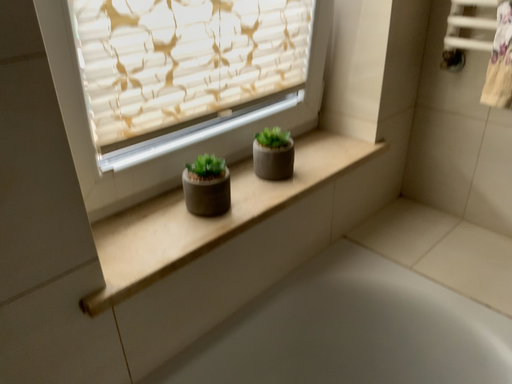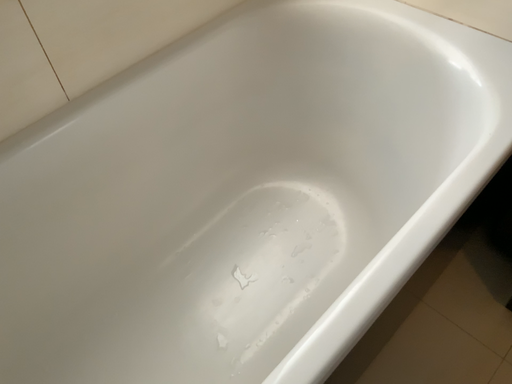
Question: How did the camera likely rotate when shooting the video?

Choices:
 (A) rotated downward
 (B) rotated upward

Answer: (A)